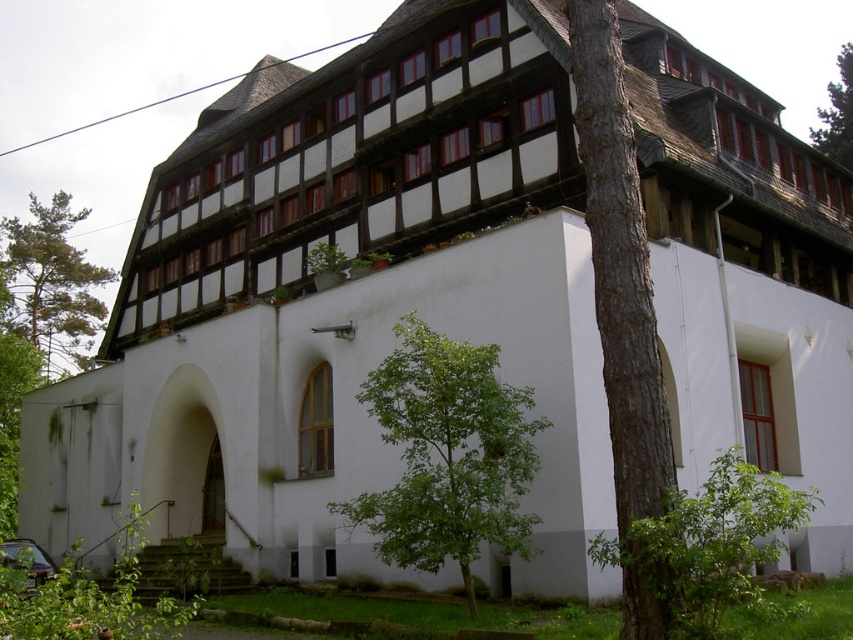
Is brown rough bark tree at center behind green leafy tree at upper right?

No.

Who is more distant from viewer, (585, 205) or (843, 163)?

The point (843, 163) is behind.

Is point (582, 16) positioned in front of point (821, 122)?

That is True.

Where is `brown rough bark tree at center`? The image size is (853, 640). brown rough bark tree at center is located at coordinates (624, 310).

Can you confirm if green leafy tree at center is bigger than green leafy tree at left?

No.

How much distance is there between green leafy tree at center and green leafy tree at left?

green leafy tree at center is 100.93 meters away from green leafy tree at left.

Identify the location of green leafy tree at center. This screenshot has width=853, height=640. (447, 456).

Locate an element on the screen. green leafy tree at center is located at coordinates (447, 456).

Which of these two, green leafy tree at center or brown rough bark tree at center, stands shorter?

green leafy tree at center is shorter.

In the scene shown: Between green leafy tree at center and brown rough bark tree at center, which one has more height?

brown rough bark tree at center is taller.

Does point (474, 548) come closer to viewer compared to point (585, 179)?

Yes, point (474, 548) is closer to viewer.

Find the location of a particular element. green leafy tree at center is located at coordinates (447, 456).